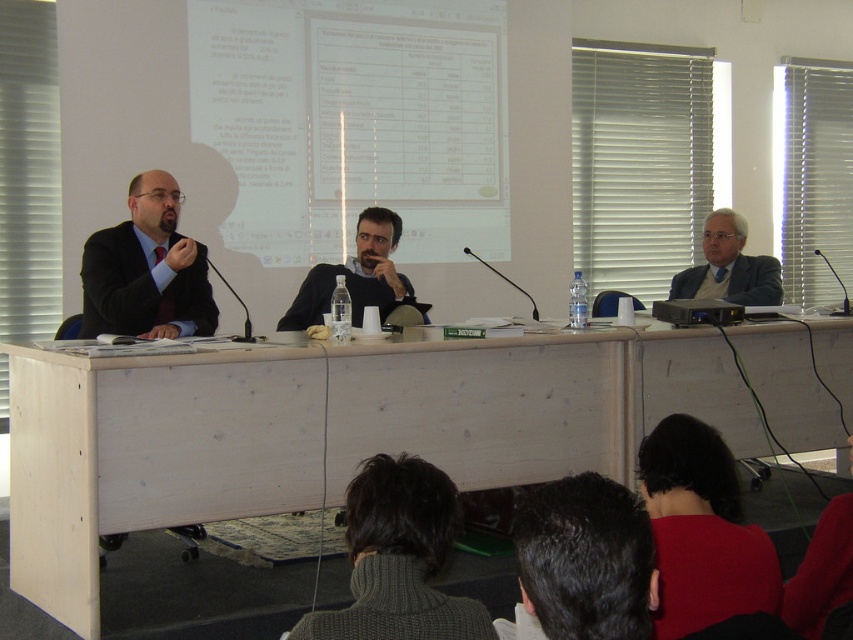
Question: Is dark red sweater at lower right thinner than matte black suit at center?

Choices:
 (A) yes
 (B) no

Answer: (A)

Question: Based on their relative distances, which object is farther from the dark brown hair at lower center?

Choices:
 (A) matte black suit at center
 (B) light wood table at center
 (C) dark red sweater at lower right

Answer: (A)

Question: Is dark brown hair at lower center positioned behind white shirt at right?

Choices:
 (A) yes
 (B) no

Answer: (B)

Question: Observing the image, what is the correct spatial positioning of light wood table at center in reference to white shirt at right?

Choices:
 (A) left
 (B) right

Answer: (A)

Question: Which point is closer to the camera taking this photo?

Choices:
 (A) (363, 524)
 (B) (390, 292)

Answer: (A)

Question: Considering the real-world distances, which object is closest to the dark brown hair at lower center?

Choices:
 (A) dark gray sweater at lower center
 (B) matte black suit at center
 (C) white shirt at right
 (D) light wood table at center

Answer: (A)